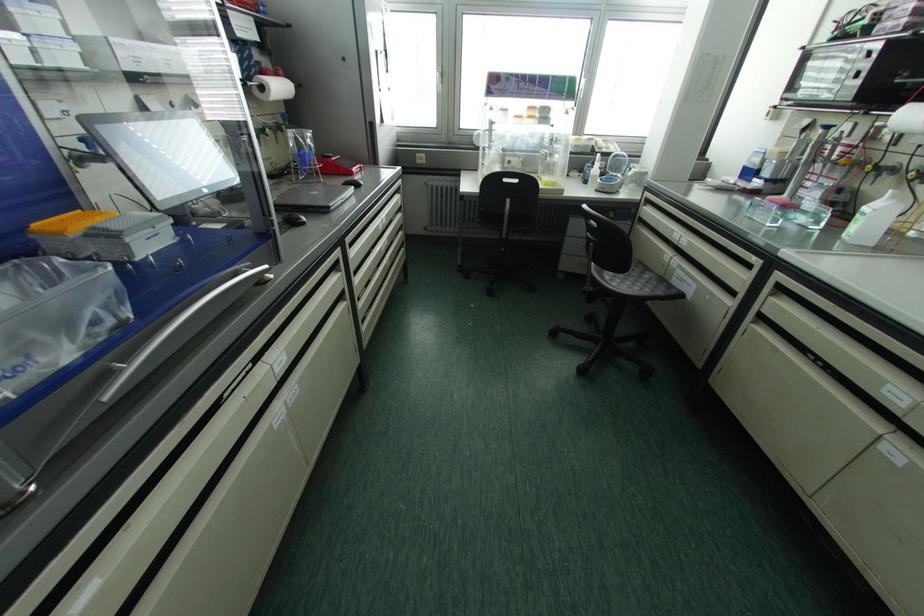
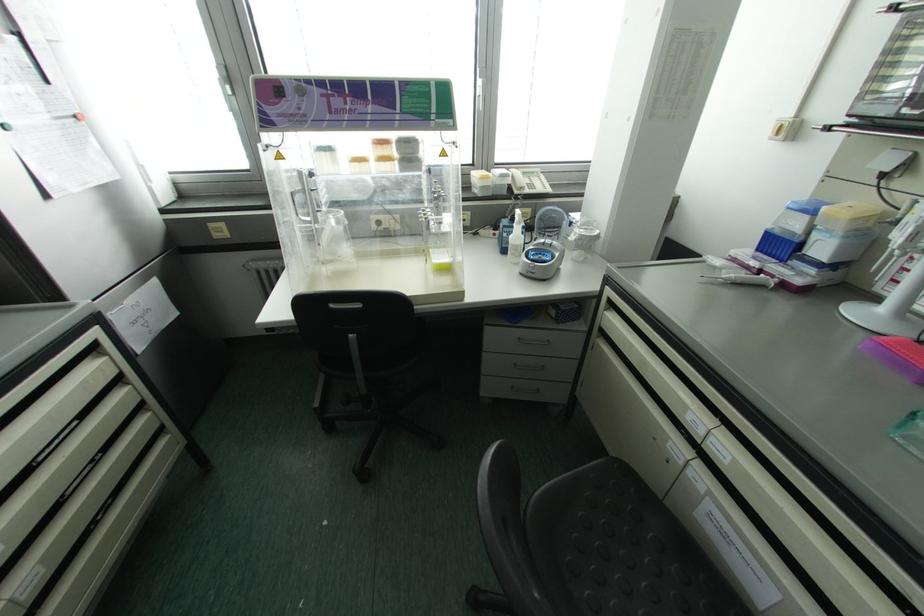
Find the pixel in the second image that matches pixel 748 174 in the first image.

(777, 245)